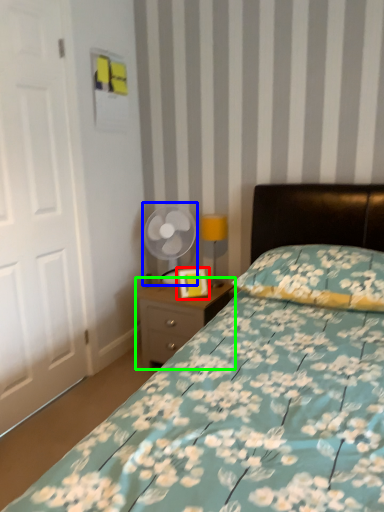
Question: Based on their relative distances, which object is farther from picture frame (highlighted by a red box)? Choose from mechanical fan (highlighted by a blue box) and nightstand (highlighted by a green box).

Choices:
 (A) mechanical fan
 (B) nightstand

Answer: (A)